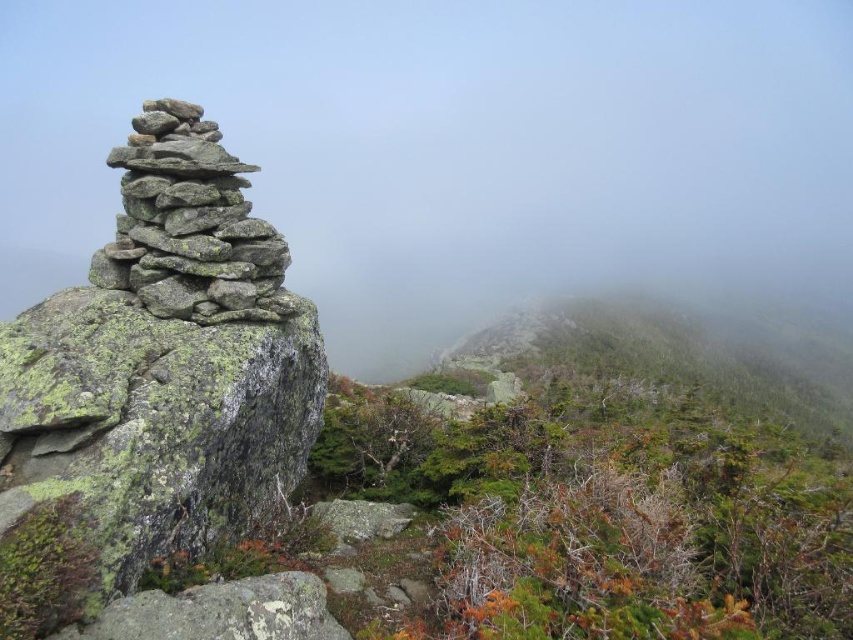
Question: Can you confirm if gray rough stone stack at left is positioned below gray rock stack at left?

Choices:
 (A) yes
 (B) no

Answer: (A)

Question: Which object is farther from the camera taking this photo?

Choices:
 (A) gray rough stone stack at left
 (B) gray rock stack at left

Answer: (B)

Question: Among these objects, which one is farthest from the camera?

Choices:
 (A) gray rock stack at left
 (B) gray rough stone stack at left

Answer: (A)

Question: Where is gray rough stone stack at left located in relation to gray rock stack at left in the image?

Choices:
 (A) below
 (B) above

Answer: (A)

Question: Considering the relative positions of gray rough stone stack at left and gray rock stack at left in the image provided, where is gray rough stone stack at left located with respect to gray rock stack at left?

Choices:
 (A) left
 (B) right

Answer: (B)